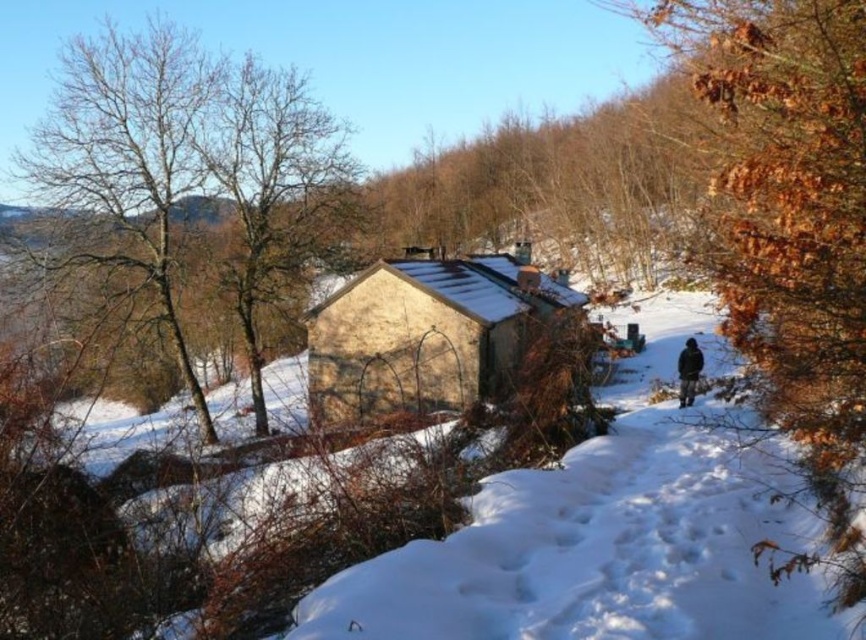
You are standing in the snowy landscape and see a point marked at coordinates (422,333). Which object does this point belong to?

The point at coordinates (422,333) is located on the yellow stucco cabin at center.